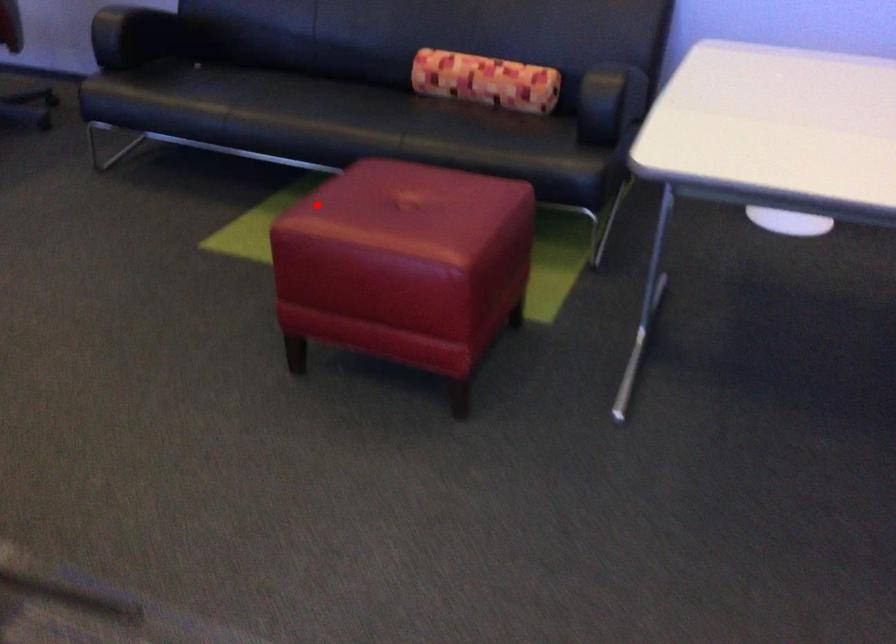
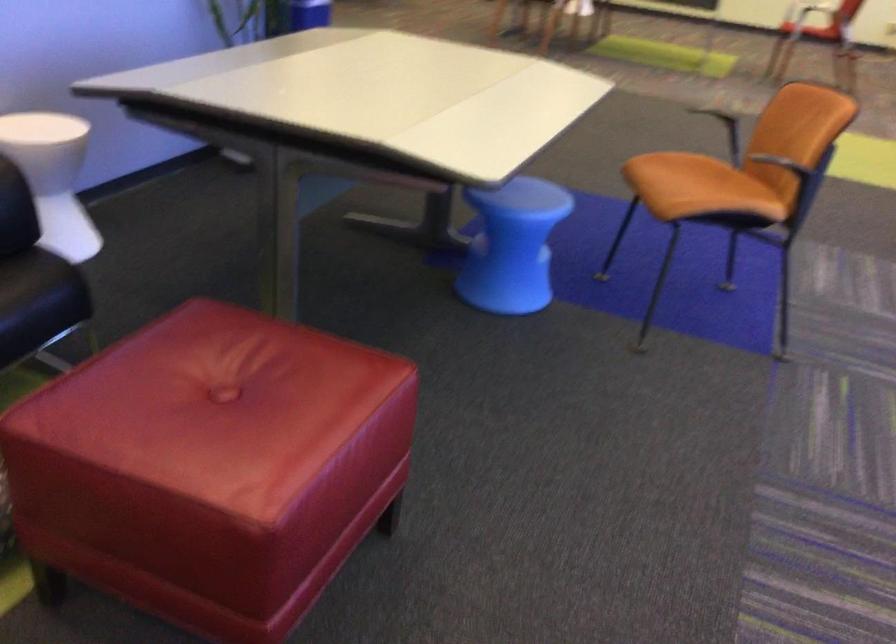
Question: I am providing you with two images of the same scene from different viewpoints. Image1 has a red point marked. In image2, the corresponding 3D location appears at what relative position? Reply with the corresponding letter.

Choices:
 (A) Closer
 (B) Farther

Answer: (A)